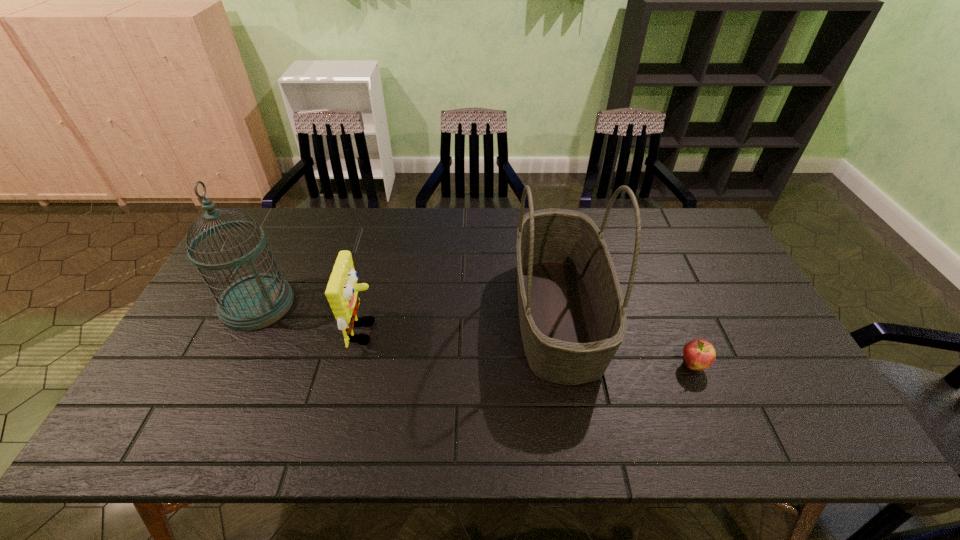
Identify the location of object present at the left edge. (256, 301).

In order to click on free region at the far edge of the desktop in this screenshot , I will do [302, 235].

Find the location of a particular element. Image resolution: width=960 pixels, height=540 pixels. free spot at the near edge of the desktop is located at coordinates (442, 422).

The image size is (960, 540). I want to click on vacant space at the left edge of the desktop, so click(x=238, y=254).

At what (x,y) coordinates should I click in order to perform the action: click on vacant space at the right edge of the desktop. Please return your answer as a coordinate pair (x, y). Looking at the image, I should click on (713, 280).

This screenshot has height=540, width=960. Identify the location of free space between the second object from right to left and the third object from right to left. (462, 323).

The image size is (960, 540). What are the coordinates of `free point between the third object from left to right and the shortest object` in the screenshot? It's located at (626, 340).

Find the location of a particular element. free space that is in between the third object from left to right and the birdcage is located at coordinates (408, 309).

This screenshot has height=540, width=960. Find the location of `free space between the second object from right to left and the leftmost object`. free space between the second object from right to left and the leftmost object is located at coordinates (408, 309).

This screenshot has width=960, height=540. Identify the location of free space that is in between the shortest object and the leftmost object. (475, 335).